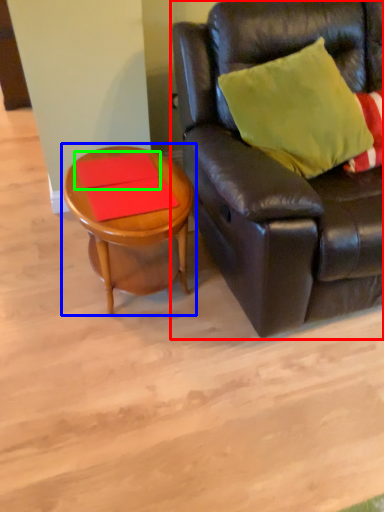
Question: Based on their relative distances, which object is farther from studio couch (highlighted by a red box)? Choose from coffee table (highlighted by a blue box) and plank (highlighted by a green box).

Choices:
 (A) coffee table
 (B) plank

Answer: (B)